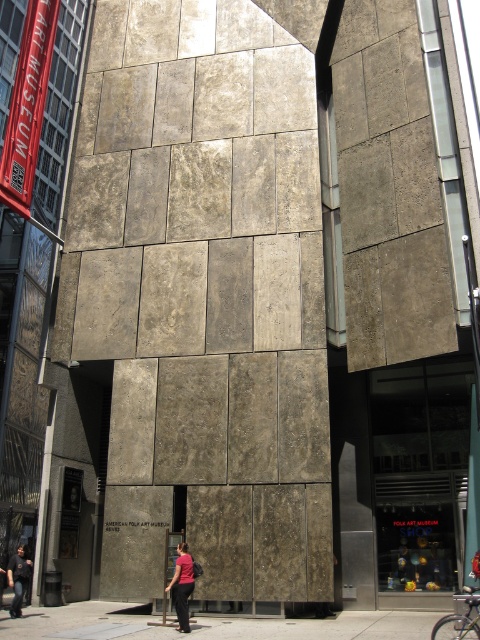
Question: Can you confirm if matte pink shirt at center is positioned to the left of dark gray concrete person at lower left?

Choices:
 (A) yes
 (B) no

Answer: (B)

Question: Can you confirm if matte pink shirt at center is positioned below dark gray concrete person at lower left?

Choices:
 (A) no
 (B) yes

Answer: (A)

Question: Is matte pink shirt at center behind dark gray concrete person at lower left?

Choices:
 (A) yes
 (B) no

Answer: (B)

Question: Which object is closer to the camera taking this photo?

Choices:
 (A) matte pink shirt at center
 (B) dark gray concrete person at lower left

Answer: (A)